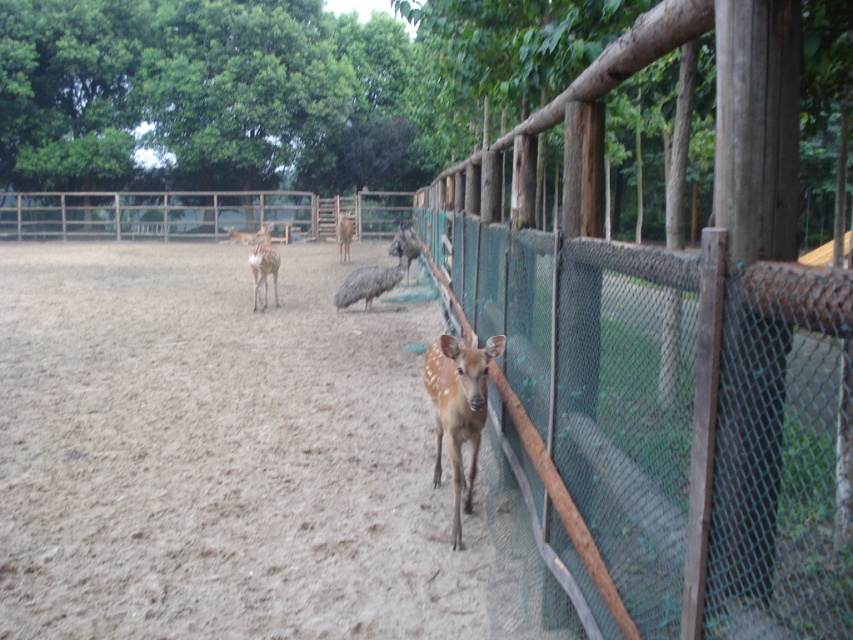
Question: Can you confirm if green mesh fence at center is positioned to the right of brown glossy deer at center?

Choices:
 (A) yes
 (B) no

Answer: (A)

Question: Which of the following is the farthest from the observer?

Choices:
 (A) (492, 342)
 (B) (253, 275)
 (C) (372, 269)

Answer: (C)

Question: Which of the following is the farthest from the observer?

Choices:
 (A) (347, 253)
 (B) (265, 305)

Answer: (A)

Question: Does green mesh fence at center appear over brown sandy dirt at center?

Choices:
 (A) no
 (B) yes

Answer: (A)

Question: Which object is the closest to the green mesh fence at center?

Choices:
 (A) brown matte deer at center
 (B) brown feathered bird at center
 (C) brown speckled fur at center

Answer: (C)

Question: Is green mesh fence at center to the left of brown speckled fur at center from the viewer's perspective?

Choices:
 (A) yes
 (B) no

Answer: (B)